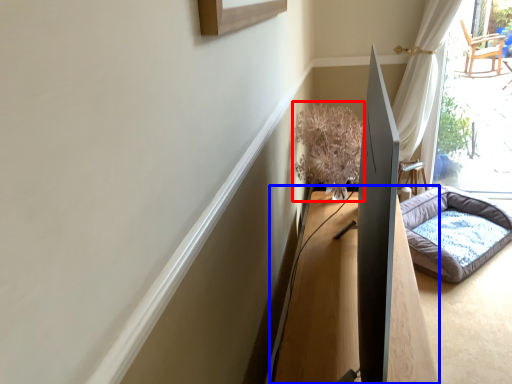
Question: Among these objects, which one is farthest to the camera, plant (highlighted by a red box) or table (highlighted by a blue box)?

Choices:
 (A) plant
 (B) table

Answer: (A)